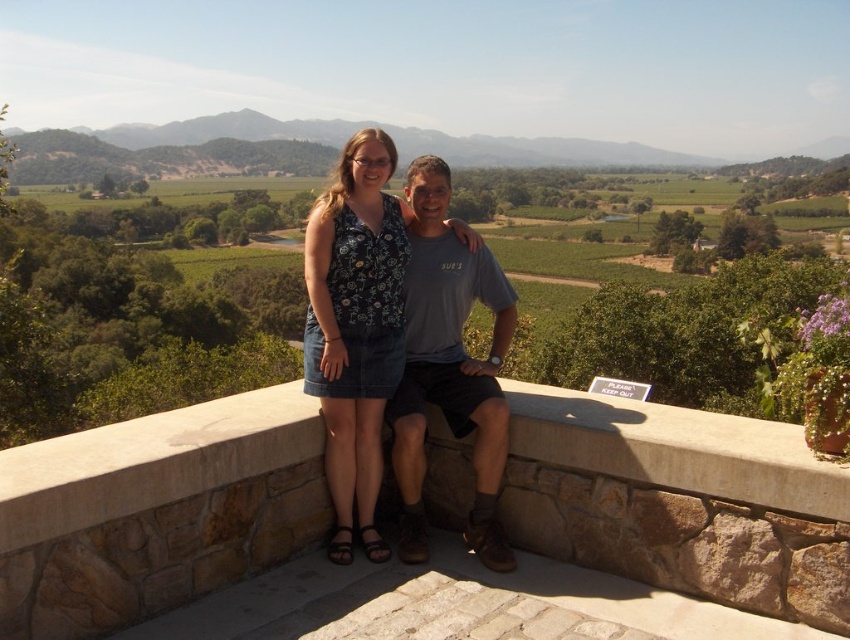
You are a photographer trying to capture a photo of the stone ledge at center and the denim skirt at center. Based on their positions, which object is located to the right of the other?

The stone ledge at center is positioned on the right side of denim skirt at center, so the stone ledge at center is to the right of the denim skirt at center.